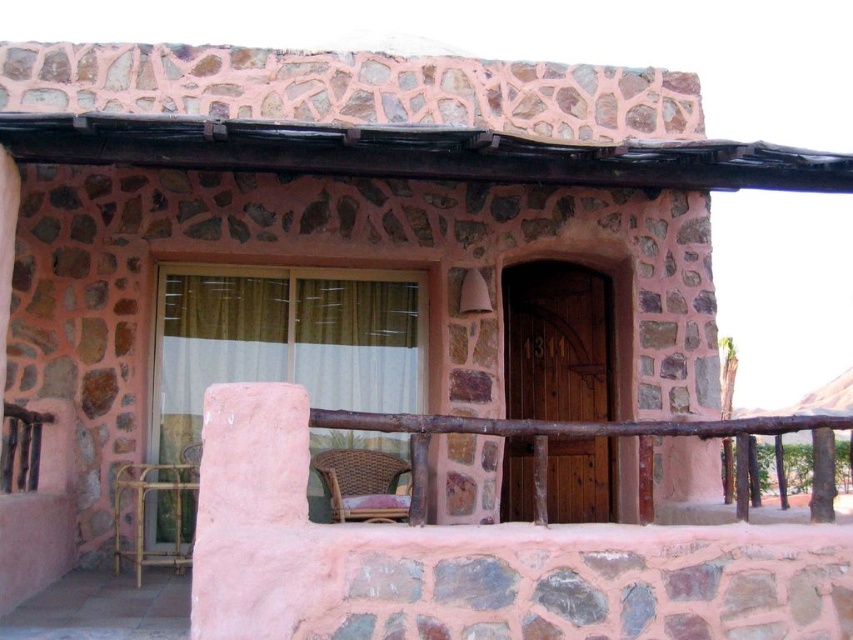
Question: Is rattan chair at lower center wider than gold bamboo balustrade at lower left?

Choices:
 (A) no
 (B) yes

Answer: (B)

Question: Considering the relative positions of rattan chair at lower center and gold bamboo balustrade at lower left in the image provided, where is rattan chair at lower center located with respect to gold bamboo balustrade at lower left?

Choices:
 (A) right
 (B) left

Answer: (A)

Question: Can you confirm if rattan chair at lower center is thinner than gold bamboo balustrade at lower left?

Choices:
 (A) yes
 (B) no

Answer: (B)

Question: Which point appears farthest from the camera in this image?

Choices:
 (A) (141, 518)
 (B) (325, 452)

Answer: (B)